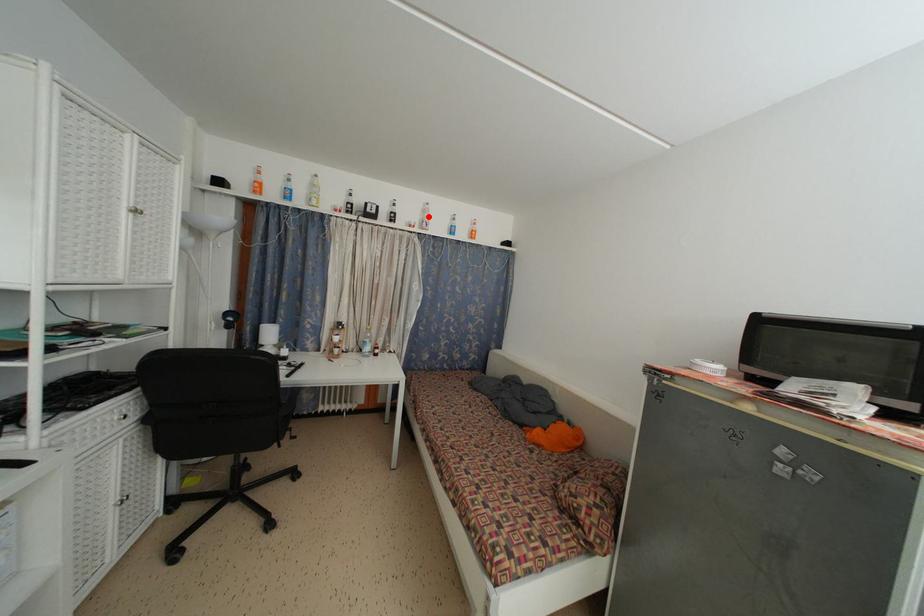
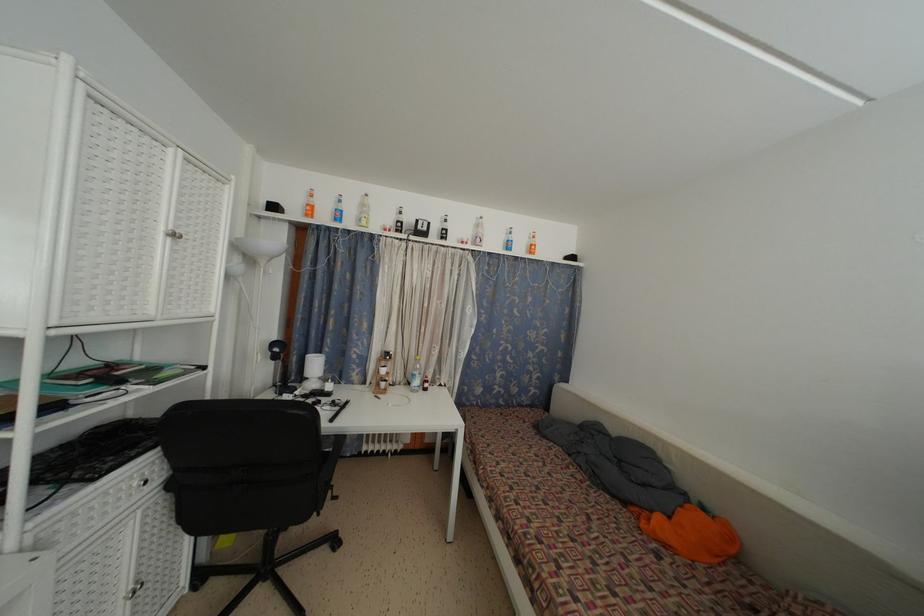
Find the pixel in the second image that matches the highlighted location in the first image.

(481, 232)